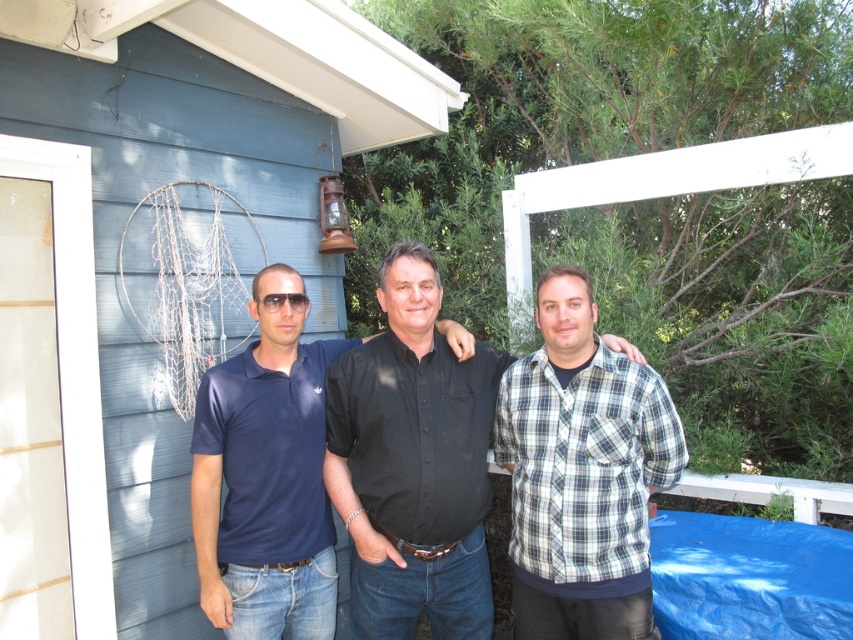
You are trying to identify the clothing details of the people in the scene. Since both the black matte shirt at center and plaid cotton shirt at center are at the center, which one is visible in front?

The plaid cotton shirt at center is behind the black matte shirt at center, so the black matte shirt at center is visible in front.

You are a photographer trying to capture the plaid cotton shirt at center in the image. The camera you are using has a focus point at coordinate point (582, 472). Based on the scene, will this focus point successfully capture the plaid cotton shirt at center?

Yes, the focus point at (582, 472) corresponds to the plaid cotton shirt at center, so it will successfully capture it.